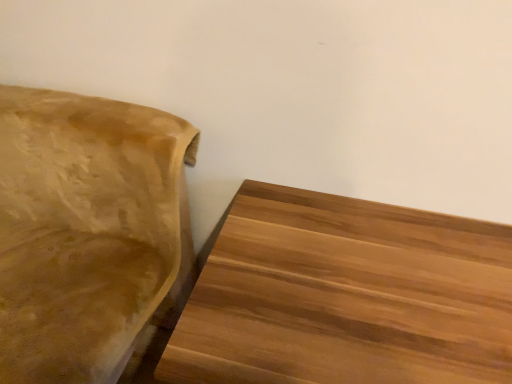
In order to click on empty space that is ontop of light brown wood table at lower right in this screenshot , I will do `click(385, 284)`.